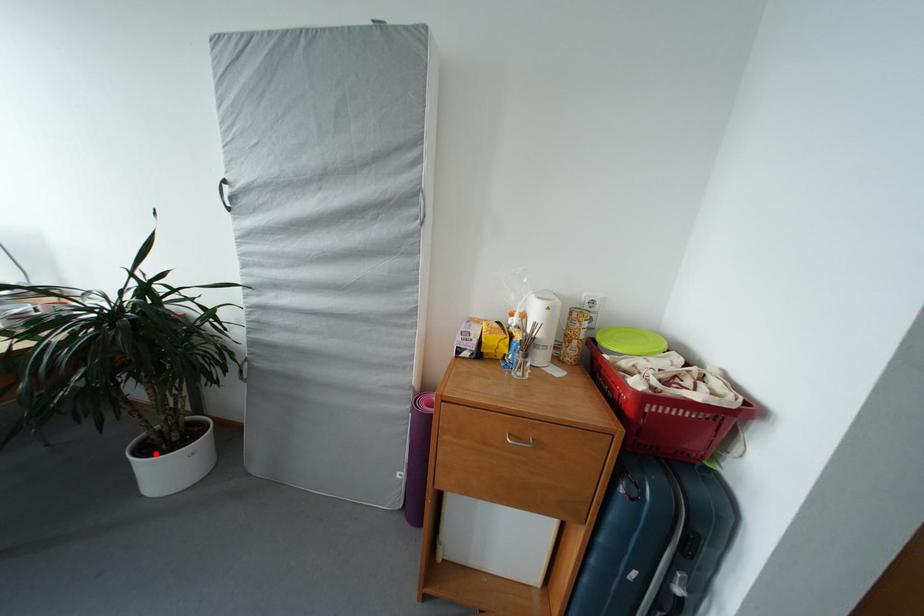
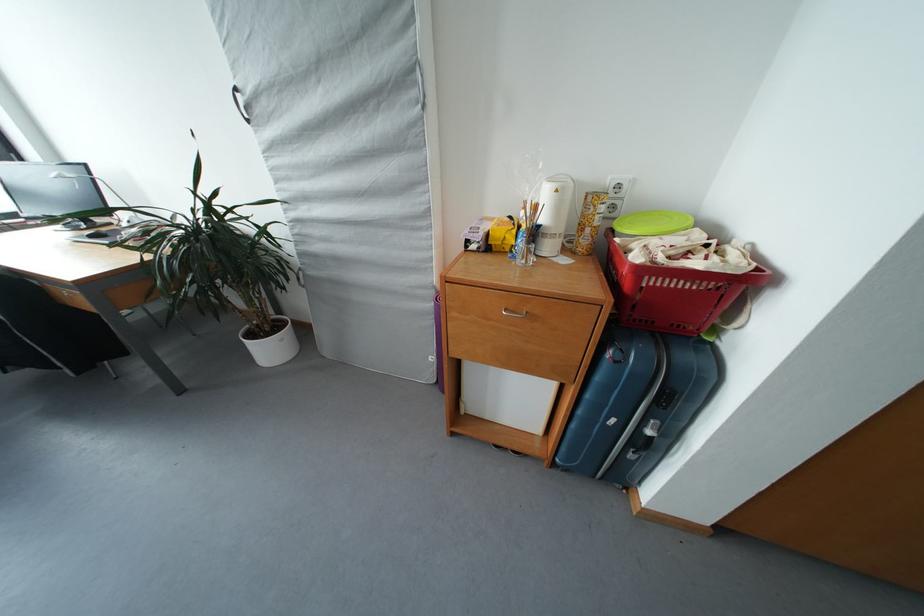
Question: I am providing you with two images of the same scene from different viewpoints. Given a red point in image1, look at the same physical point in image2. Is it:

Choices:
 (A) Closer to the viewpoint
 (B) Farther from the viewpoint

Answer: (A)